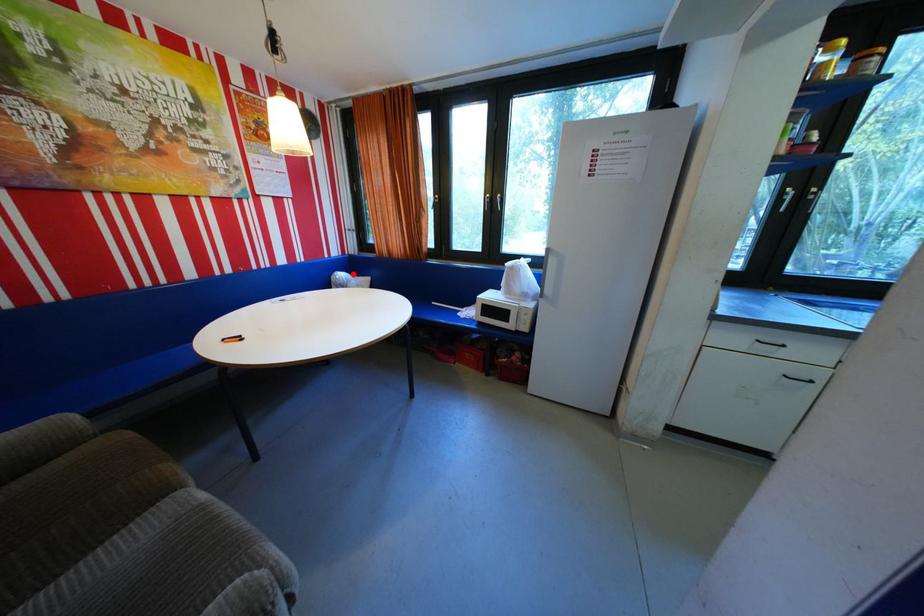
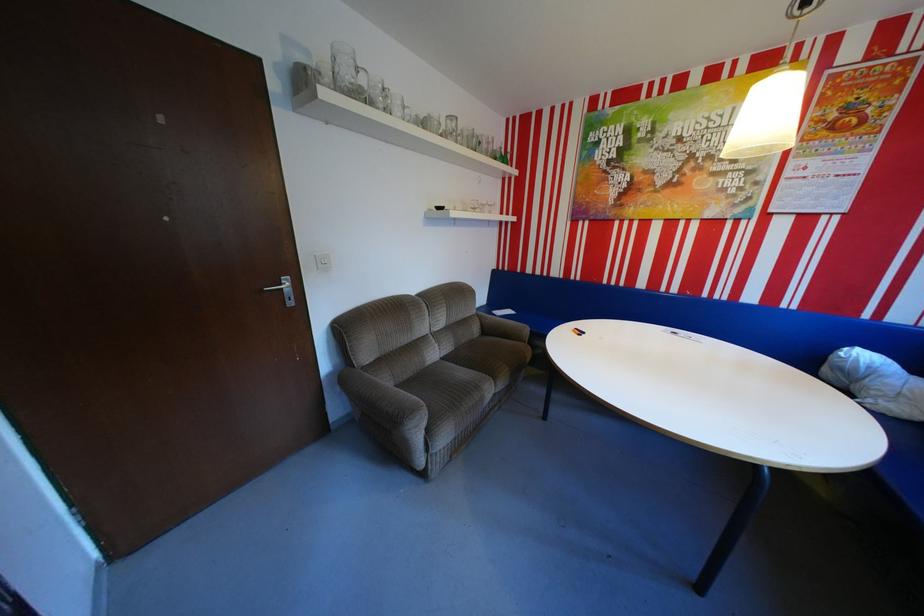
Question: I am providing you with two images of the same scene from different viewpoints. In image1, a red point is highlighted. Considering the same 3D point in image2, which of the following is correct?

Choices:
 (A) It is closer
 (B) It is farther

Answer: (B)